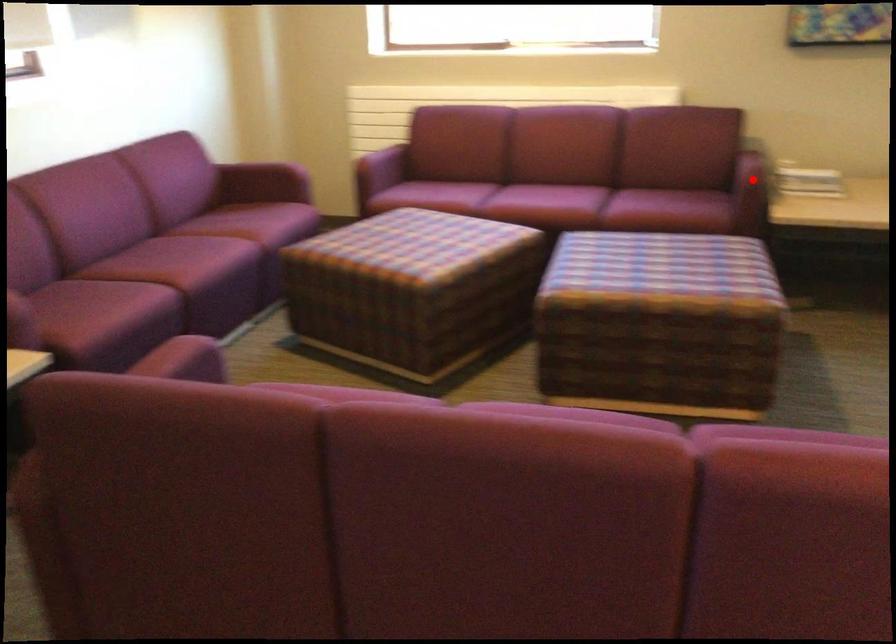
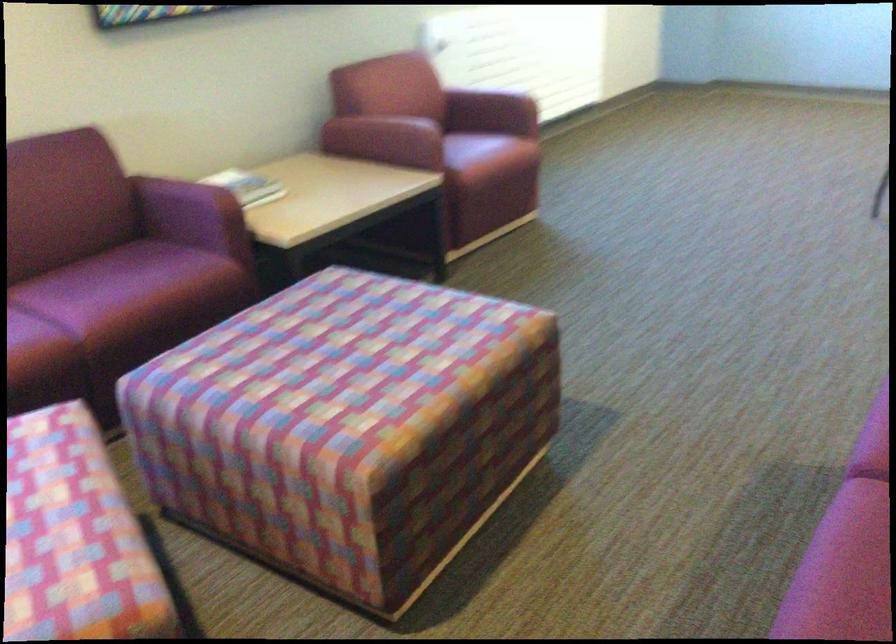
Question: I am providing you with two images of the same scene from different viewpoints. A red point is marked on the first image. At the location where the point appears in image 1, is it still visible in image 2?

Choices:
 (A) Yes
 (B) No

Answer: (B)